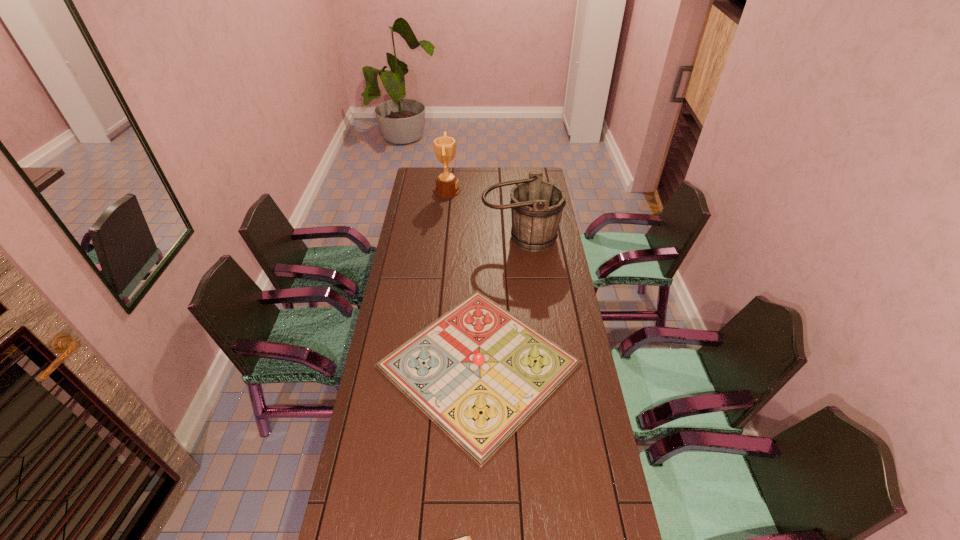
At what (x,y) coordinates should I click in order to perform the action: click on the farthest object. Please return your answer as a coordinate pair (x, y). The image size is (960, 540). Looking at the image, I should click on (447, 185).

The height and width of the screenshot is (540, 960). I want to click on the second farthest object, so click(x=536, y=206).

This screenshot has width=960, height=540. I want to click on gameboard, so click(478, 372).

Locate an element on the screen. the third tallest object is located at coordinates 478,372.

The image size is (960, 540). In order to click on vacant area situated on the front-facing side of the award in this screenshot , I will do `click(526, 190)`.

You are a GUI agent. You are given a task and a screenshot of the screen. Output one action in this format:
    pyautogui.click(x=<x>, y=<y>)
    Task: Click on the vacant region located 0.390m on the handle side of the bucket
    This screenshot has height=540, width=960.
    Given the screenshot: What is the action you would take?
    pyautogui.click(x=529, y=321)

Locate an element on the screen. The image size is (960, 540). vacant region located on the back of the gameboard is located at coordinates (479, 245).

This screenshot has width=960, height=540. What are the coordinates of `object at the far edge` in the screenshot? It's located at (447, 185).

At what (x,y) coordinates should I click in order to perform the action: click on award positioned at the left edge. Please return your answer as a coordinate pair (x, y). This screenshot has width=960, height=540. Looking at the image, I should click on (447, 185).

This screenshot has height=540, width=960. I want to click on gameboard that is positioned at the left edge, so click(x=478, y=372).